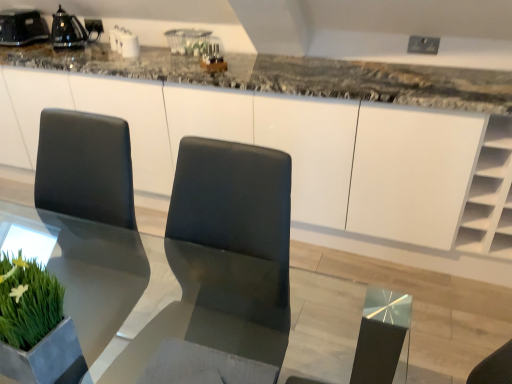
Question: Based on their positions, is black glossy kettle at upper left, arranged as the 2th appliance when viewed from the left, located to the left or right of black glossy kettle at upper left, the 2th appliance in the right-to-left sequence?

Choices:
 (A) left
 (B) right

Answer: (B)

Question: Is black glossy kettle at upper left, arranged as the 2th appliance when viewed from the left, spatially inside black glossy kettle at upper left, positioned as the 1th appliance in left-to-right order, or outside of it?

Choices:
 (A) outside
 (B) inside

Answer: (A)

Question: Which object is the farthest from the black glossy kettle at upper left, which is counted as the first appliance, starting from the right?

Choices:
 (A) transparent glass table at center
 (B) green leafy plant at lower left
 (C) black glossy kettle at upper left, positioned as the 1th appliance in left-to-right order

Answer: (B)

Question: Which object is the closest to the transparent glass table at center?

Choices:
 (A) green leafy plant at lower left
 (B) black glossy kettle at upper left, which is counted as the first appliance, starting from the right
 (C) black glossy kettle at upper left, the 2th appliance in the right-to-left sequence

Answer: (A)